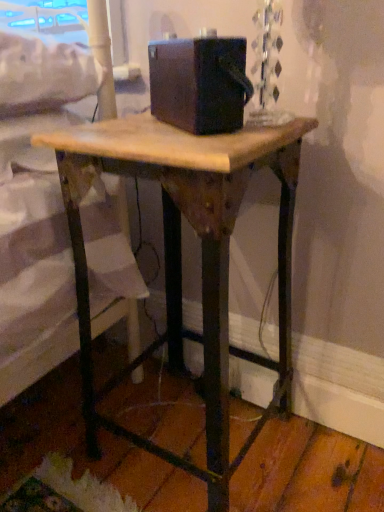
At what (x,y) coordinates should I click in order to perform the action: click on vacant region to the left of wooden table at center. Please return your answer as a coordinate pair (x, y). This screenshot has width=384, height=512. Looking at the image, I should click on (73, 429).